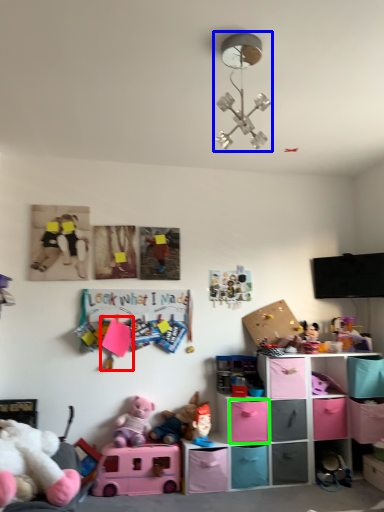
Question: Based on their relative distances, which object is farther from toy (highlighted by a red box)? Choose from light fixture (highlighted by a blue box) and shelf (highlighted by a green box).

Choices:
 (A) light fixture
 (B) shelf

Answer: (A)